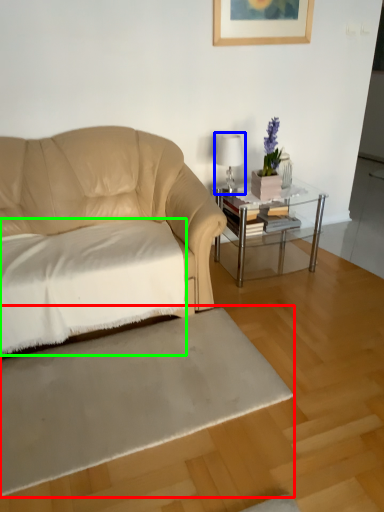
Question: Considering the real-world distances, which object is farthest from flat (highlighted by a red box)? table lamp (highlighted by a blue box) or sheet (highlighted by a green box)?

Choices:
 (A) table lamp
 (B) sheet

Answer: (A)